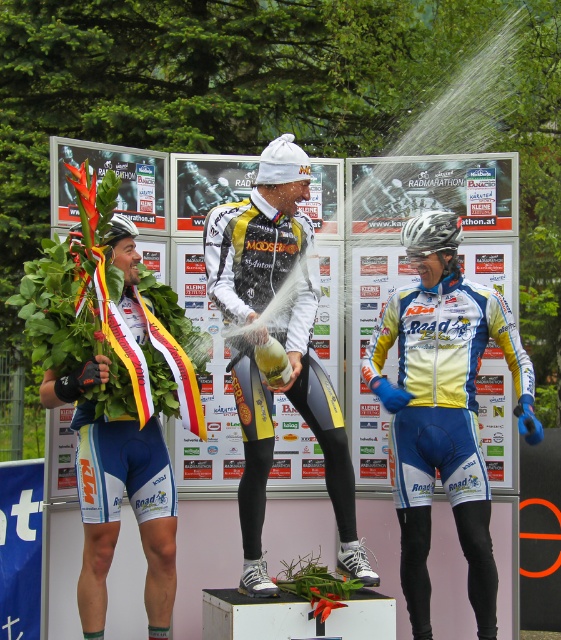
You are a photographer at the event and need to position yourself so that both the point at (499, 323) and the point at (117, 232) are visible in your shot. Given that you can only move forward or backward along a straight path, which direction should you move to ensure both points are in frame?

To ensure both points are visible, you should move backward because point (499, 323) is behind point (117, 232). Moving backward will allow you to capture both points in your frame without one blocking the other.